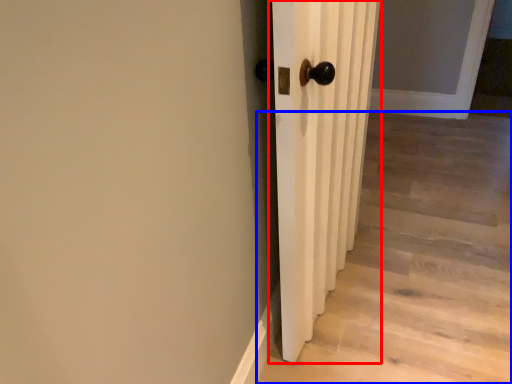
Question: Which object appears closest to the camera in this image, door (highlighted by a red box) or stairwell (highlighted by a blue box)?

Choices:
 (A) door
 (B) stairwell

Answer: (A)